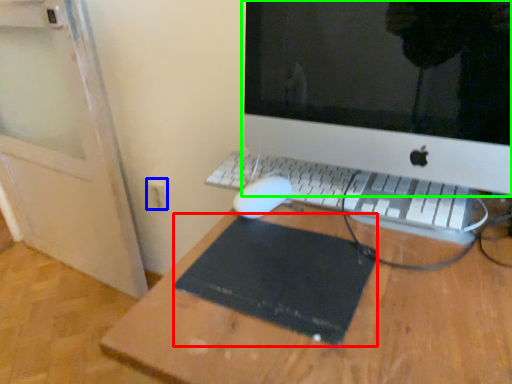
Question: Which object is the farthest from mousepad (highlighted by a red box)? Choose among these: electric outlet (highlighted by a blue box) or computer monitor (highlighted by a green box).

Choices:
 (A) electric outlet
 (B) computer monitor

Answer: (B)